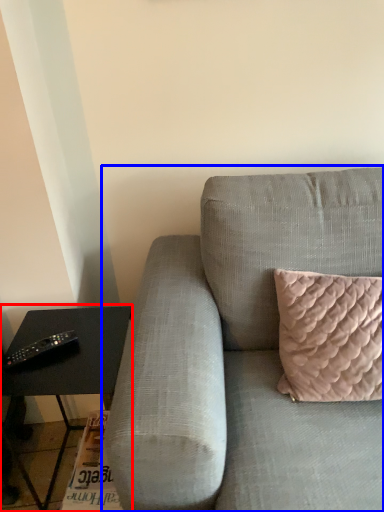
Question: Which object is closer to the camera taking this photo, table (highlighted by a red box) or studio couch (highlighted by a blue box)?

Choices:
 (A) table
 (B) studio couch

Answer: (B)